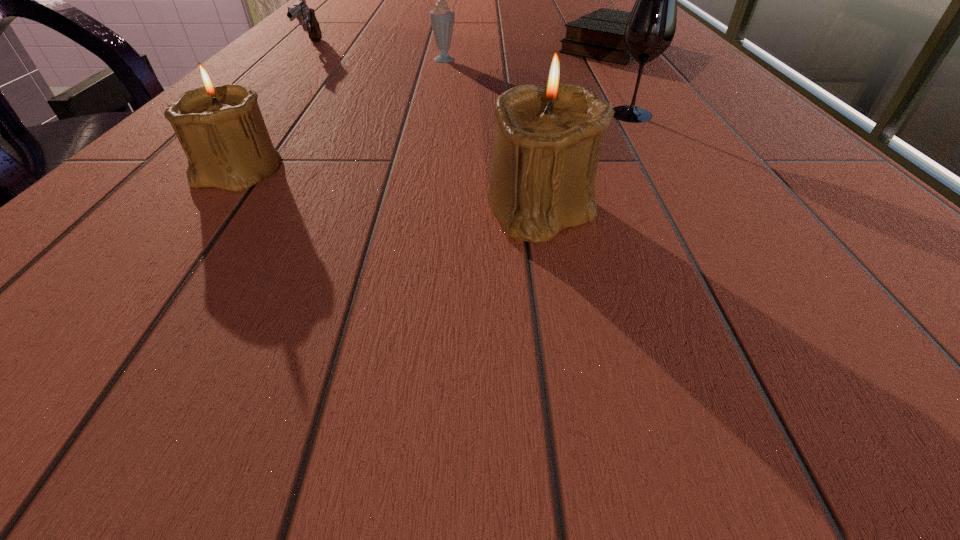
You are a GUI agent. You are given a task and a screenshot of the screen. Output one action in this format:
    pyautogui.click(x=<x>, y=<y>)
    Task: Click on the left candle_holder
    
    Given the screenshot: What is the action you would take?
    pyautogui.click(x=221, y=129)

Where is `the fourth object from left to right`? the fourth object from left to right is located at coordinates (548, 136).

Where is `the taller candle_holder`? the taller candle_holder is located at coordinates (548, 136).

The width and height of the screenshot is (960, 540). Find the location of `wineglass`. wineglass is located at coordinates (650, 28).

The image size is (960, 540). Identify the location of milkshake. (442, 18).

Image resolution: width=960 pixels, height=540 pixels. I want to click on the shortest object, so click(600, 34).

Locate an element on the screen. The image size is (960, 540). the fifth tallest object is located at coordinates (306, 16).

The width and height of the screenshot is (960, 540). I want to click on free space located on the back of the left candle_holder, so click(273, 127).

In order to click on vacant space located on the right of the right candle_holder in this screenshot , I will do pyautogui.click(x=655, y=207).

Find the location of a particular element. The width and height of the screenshot is (960, 540). vacant space located 0.400m on the back of the wineglass is located at coordinates (584, 37).